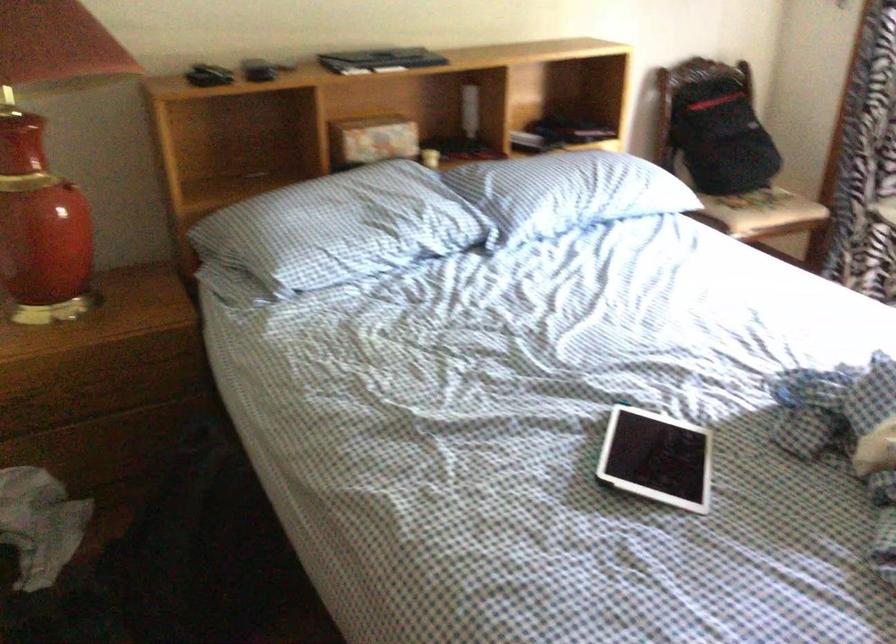
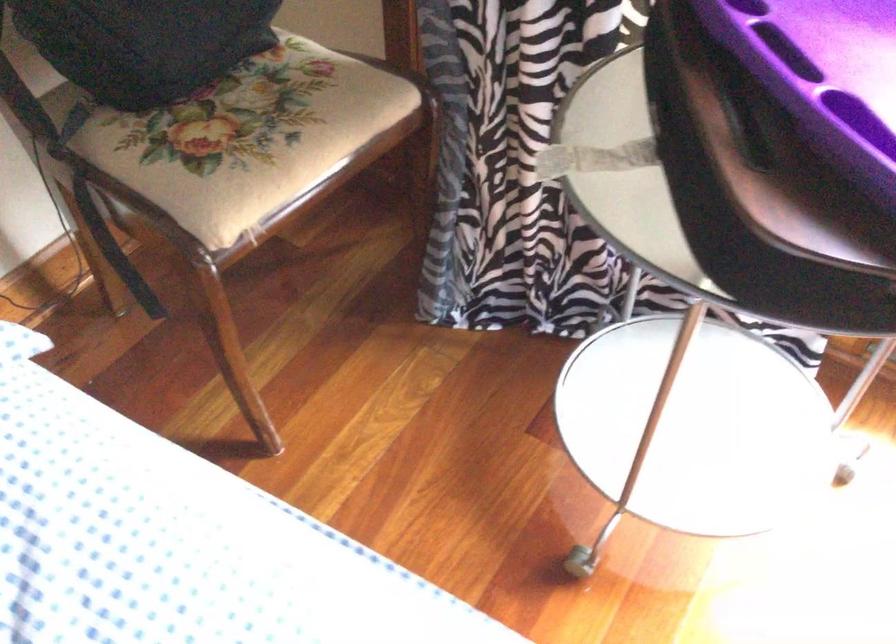
Find the pixel in the second image that matches (x=772, y=194) in the first image.

(259, 145)